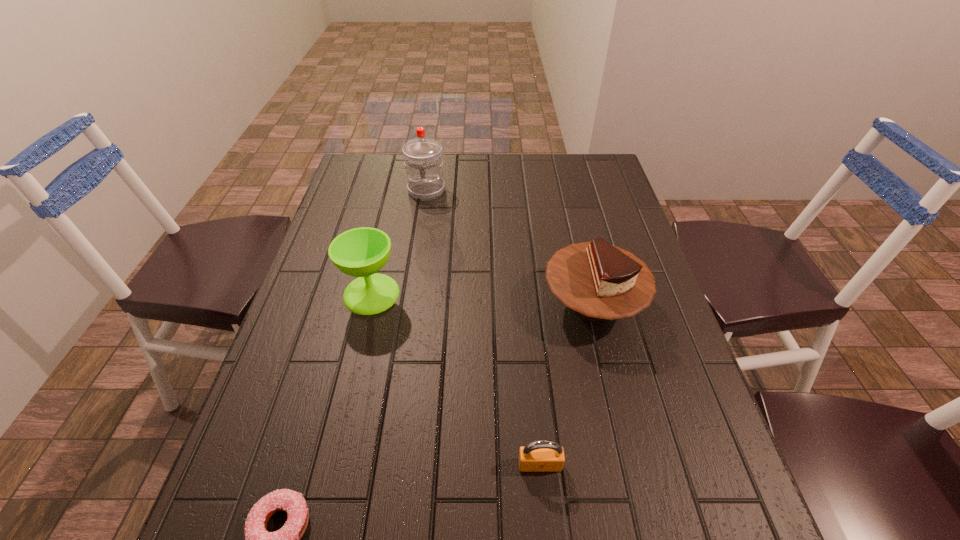
The height and width of the screenshot is (540, 960). I want to click on vacant area that lies between the cake and the water bottle, so click(510, 247).

Locate an element on the screen. The width and height of the screenshot is (960, 540). unoccupied area between the fourth object from left to right and the farthest object is located at coordinates [x=483, y=327].

I want to click on object that stands as the second closest to the wineglass, so click(599, 281).

Find the location of `object that is the third closest one to the cake`. object that is the third closest one to the cake is located at coordinates (423, 162).

At what (x,y) coordinates should I click in order to perform the action: click on free region that satisfies the following two spatial constraints: 1. on the front side of the wineglass; 2. on the left side of the rightmost object. Please return your answer as a coordinate pair (x, y). This screenshot has width=960, height=540. Looking at the image, I should click on (369, 305).